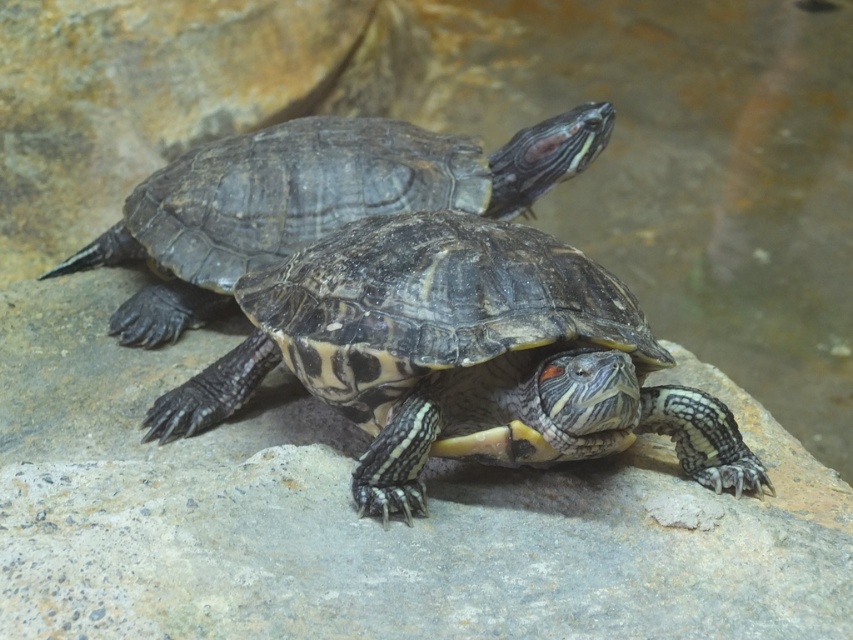
Question: Can you confirm if patterned shell turtle at center is positioned below shiny dark tortoise at center?

Choices:
 (A) yes
 (B) no

Answer: (A)

Question: Which of the following is the farthest from the observer?

Choices:
 (A) shiny dark tortoise at center
 (B) patterned shell turtle at center

Answer: (A)

Question: Does patterned shell turtle at center lie in front of shiny dark tortoise at center?

Choices:
 (A) no
 (B) yes

Answer: (B)

Question: Is patterned shell turtle at center positioned behind shiny dark tortoise at center?

Choices:
 (A) yes
 (B) no

Answer: (B)